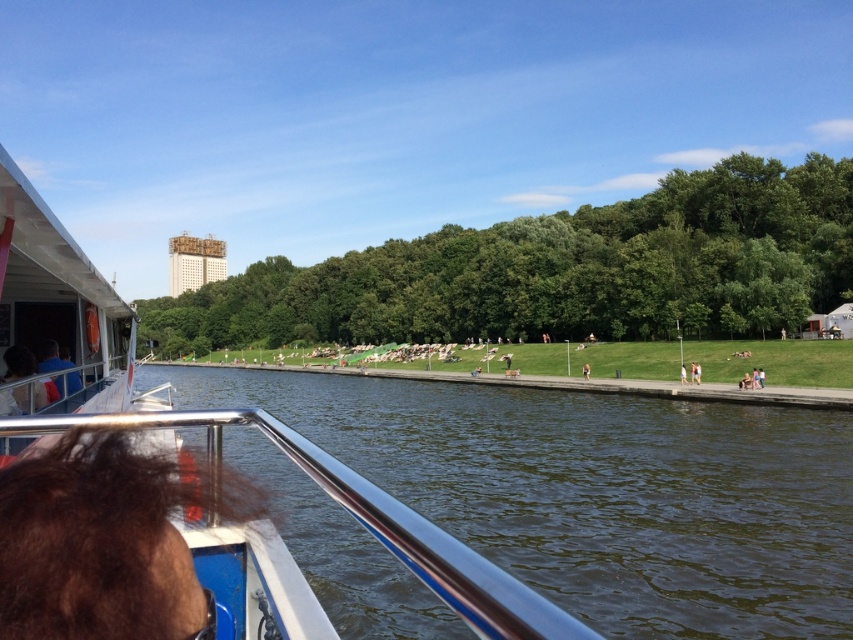
Between point (270, 376) and point (33, 368), which one is positioned in front?

Point (33, 368) is more forward.

Is dark green water at center behind matte black hair at lower left?

No, dark green water at center is closer to the viewer.

Identify the location of dark green water at center. (596, 492).

Can you confirm if dark green water at center is smaller than blue fabric shirt at left?

No, dark green water at center is not smaller than blue fabric shirt at left.

Is dark green water at center closer to camera compared to blue fabric shirt at left?

Yes, it is in front of blue fabric shirt at left.

The height and width of the screenshot is (640, 853). Identify the location of dark green water at center. (596, 492).

Locate an element on the screen. The width and height of the screenshot is (853, 640). dark green water at center is located at coordinates (596, 492).

Between blue fabric shirt at left and brown fabric person at center, which one has more height?

brown fabric person at center is taller.

Who is lower down, blue fabric shirt at left or brown fabric person at center?

brown fabric person at center is lower down.

Where is `blue fabric shirt at left`? This screenshot has height=640, width=853. blue fabric shirt at left is located at coordinates coord(51,356).

You are a GUI agent. You are given a task and a screenshot of the screen. Output one action in this format:
    pyautogui.click(x=<x>, y=<y>)
    Task: Click on the blue fabric shirt at left
    Image resolution: width=853 pixels, height=640 pixels.
    Given the screenshot: What is the action you would take?
    pyautogui.click(x=51, y=356)